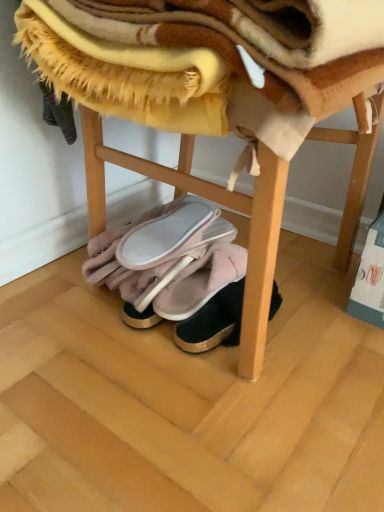
The height and width of the screenshot is (512, 384). What are the coordinates of `free location above velvet pink slippers at center, arranged as the 4th footwear when viewed from the left (from a real-world perspective)` in the screenshot? It's located at (220, 298).